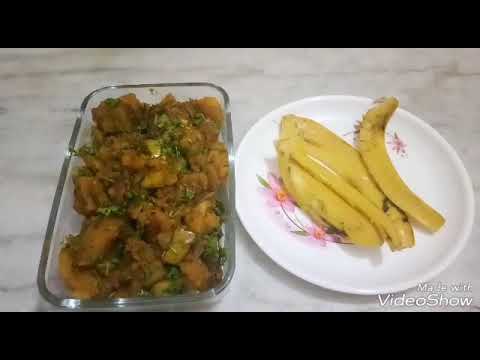
Locate an element on the screen. dish is located at coordinates (187, 87).